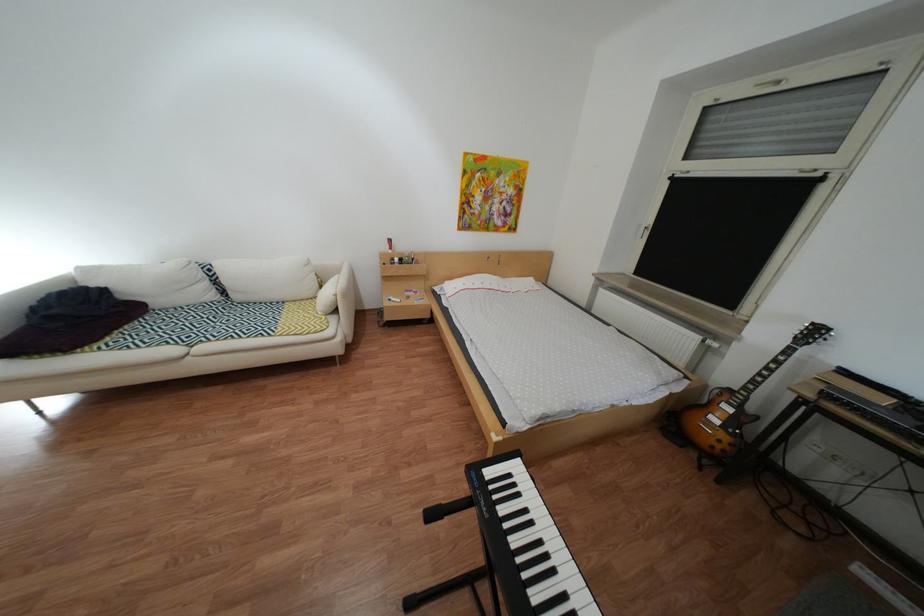
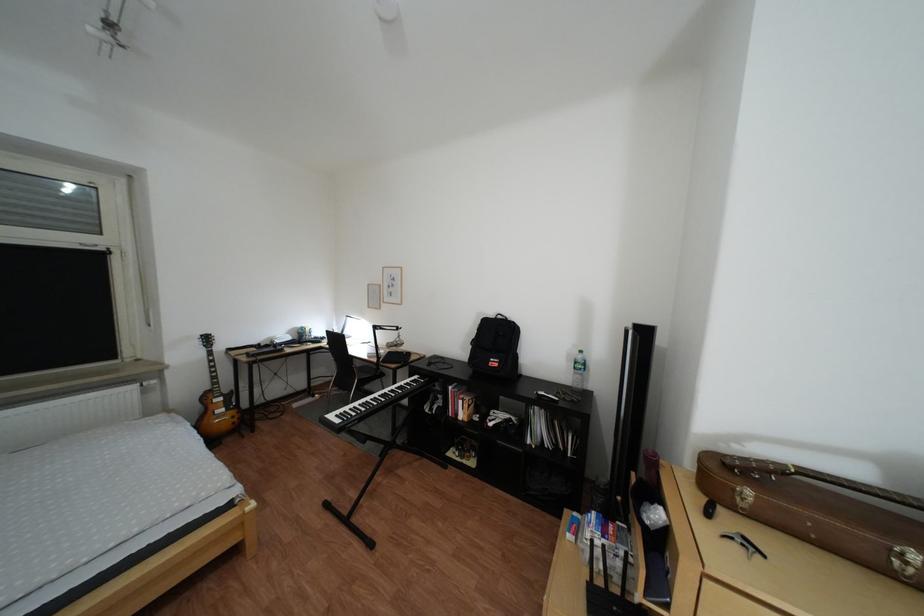
Locate, in the second image, the point that corresponds to [810,330] in the first image.

(213, 344)